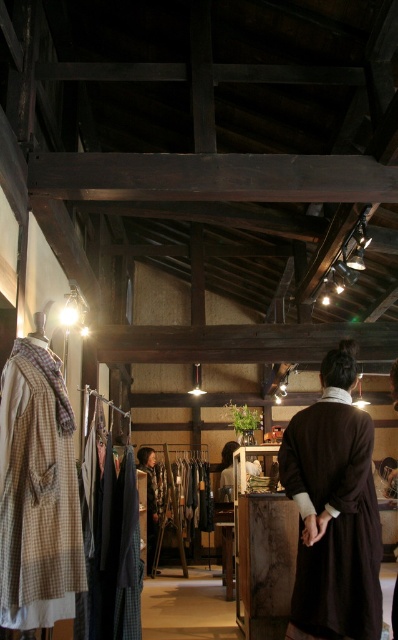
Which is behind, point (56, 488) or point (253, 461)?

The point (253, 461) is behind.

Which is below, brown woolen coat at left or matte brown coat at center?

Positioned lower is matte brown coat at center.

Who is more distant from viewer, (33, 493) or (259, 472)?

Point (259, 472)

This screenshot has height=640, width=398. What are the coordinates of `brown woolen coat at left` in the screenshot? It's located at (37, 490).

From the picture: Does brown wool coat at center have a smaller size compared to matte brown coat at center?

Indeed, brown wool coat at center has a smaller size compared to matte brown coat at center.

Measure the distance from brown wool coat at center to matte brown coat at center.

brown wool coat at center is 1.10 meters from matte brown coat at center.

Who is more distant from viewer, [158,572] or [220,493]?

Positioned behind is point [158,572].

Find the location of a particular element. This screenshot has width=398, height=640. brown wool coat at center is located at coordinates (150, 500).

Between brown woolen coat at left and brown wool coat at center, which one has less height?

brown woolen coat at left is shorter.

Is brown woolen coat at left thinner than brown wool coat at center?

Incorrect, brown woolen coat at left's width is not less than brown wool coat at center's.

Who is more forward, (66, 486) or (150, 513)?

Point (66, 486) is in front.

The width and height of the screenshot is (398, 640). Identify the location of brown woolen coat at left. (37, 490).